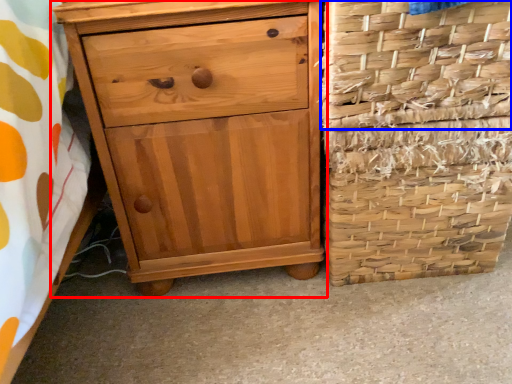
Question: Which of the following is the farthest to the observer, chest of drawers (highlighted by a red box) or basket (highlighted by a blue box)?

Choices:
 (A) chest of drawers
 (B) basket

Answer: (A)